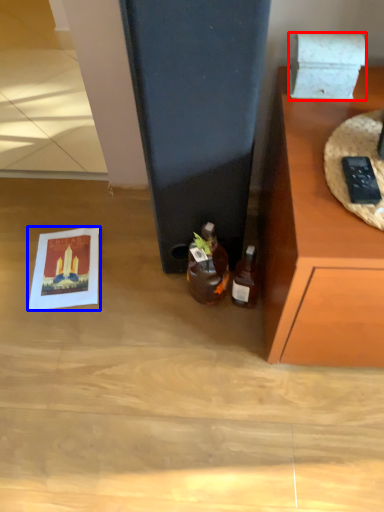
Question: Which point is further to the camera, box (highlighted by a red box) or postcard (highlighted by a blue box)?

Choices:
 (A) box
 (B) postcard

Answer: (B)